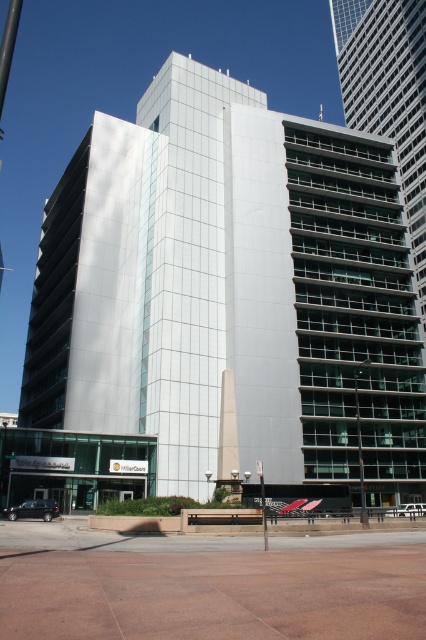
Question: Which point is closer to the camera?

Choices:
 (A) (363, 513)
 (B) (115, 227)

Answer: (A)

Question: Can you confirm if white glass building at center is bigger than white plastic street sign at center?

Choices:
 (A) yes
 (B) no

Answer: (A)

Question: Does white glass building at center have a lesser width compared to metallic pole at right?

Choices:
 (A) no
 (B) yes

Answer: (A)

Question: Which of the following is the closest to the observer?

Choices:
 (A) metallic pole at right
 (B) white plastic street sign at center

Answer: (B)

Question: Which of these objects is positioned farthest from the metallic pole at right?

Choices:
 (A) white plastic street sign at center
 (B) white glass building at center

Answer: (B)

Question: Is white glass building at center below white plastic street sign at center?

Choices:
 (A) no
 (B) yes

Answer: (A)